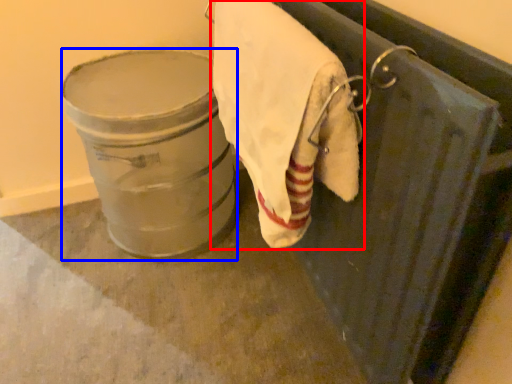
Question: Among these objects, which one is farthest to the camera, towel (highlighted by a red box) or lift (highlighted by a blue box)?

Choices:
 (A) towel
 (B) lift

Answer: (B)